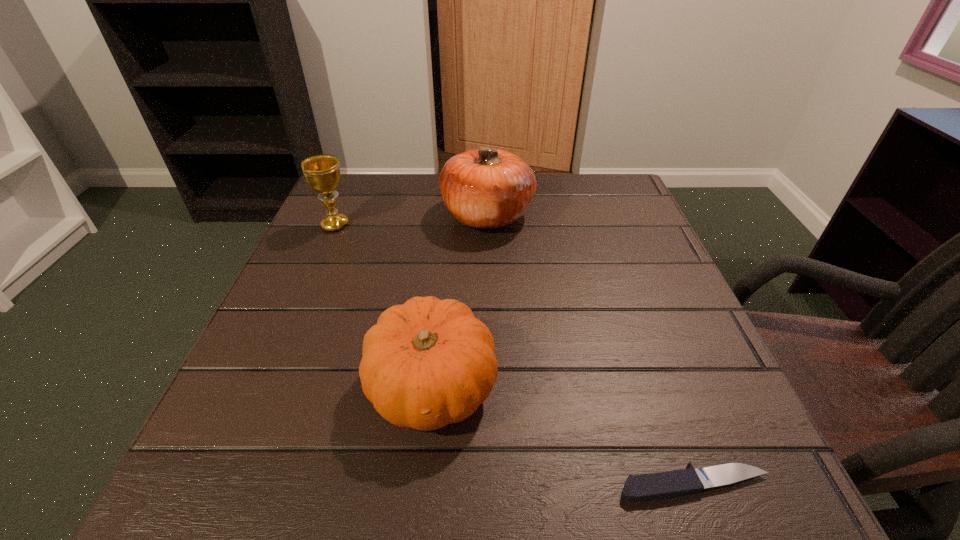
The width and height of the screenshot is (960, 540). I want to click on the taller pumpkin, so click(x=487, y=188).

At what (x,y) coordinates should I click in order to perform the action: click on the leftmost object. Please return your answer as a coordinate pair (x, y). The width and height of the screenshot is (960, 540). Looking at the image, I should click on (322, 174).

Locate an element on the screen. This screenshot has height=540, width=960. the second nearest object is located at coordinates (427, 363).

What are the coordinates of `the third tallest object` in the screenshot? It's located at point(427,363).

Image resolution: width=960 pixels, height=540 pixels. In order to click on steak knife in this screenshot , I will do `click(663, 485)`.

Locate an element on the screen. the shortest object is located at coordinates (663, 485).

The image size is (960, 540). In order to click on free region located on the back of the farther pumpkin in this screenshot , I will do `click(487, 178)`.

You are a GUI agent. You are given a task and a screenshot of the screen. Output one action in this format:
    pyautogui.click(x=<x>, y=<y>)
    Task: Click on the free region located on the front of the leftmost object
    This screenshot has width=960, height=540.
    Given the screenshot: What is the action you would take?
    pyautogui.click(x=309, y=286)

Where is `vacant space located on the right of the third farthest object`? vacant space located on the right of the third farthest object is located at coordinates (648, 386).

Image resolution: width=960 pixels, height=540 pixels. What are the coordinates of `vacant space located on the back of the steak knife` in the screenshot? It's located at (631, 309).